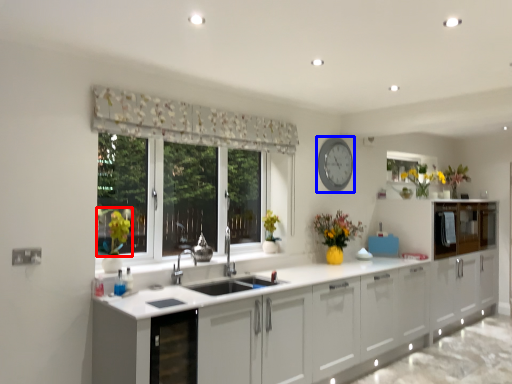
Question: Which object appears closest to the camera in this image, plant (highlighted by a red box) or clock (highlighted by a blue box)?

Choices:
 (A) plant
 (B) clock

Answer: (A)